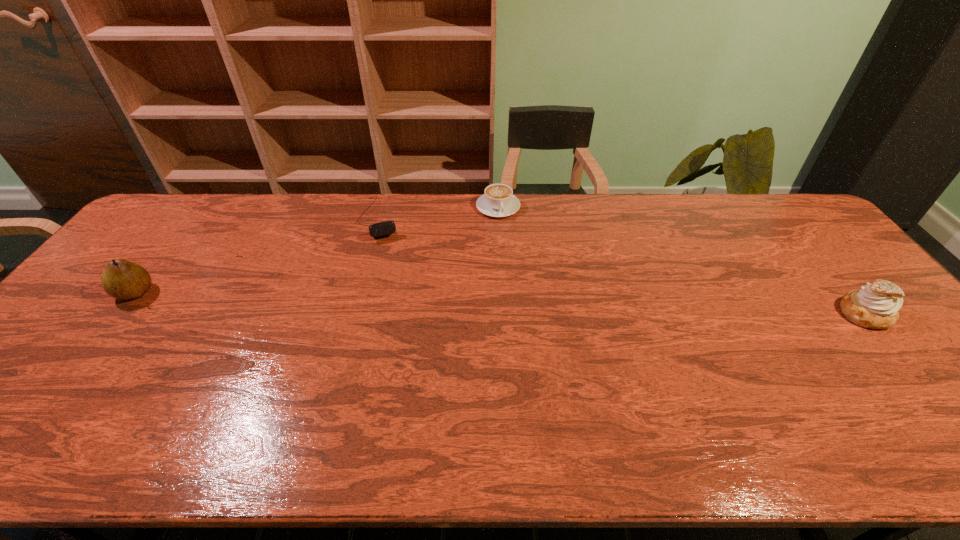
The image size is (960, 540). I want to click on free space located on the side of the cappuccino with the handle, so click(x=523, y=280).

The width and height of the screenshot is (960, 540). What are the coordinates of `vacant space situated 0.240m on the front-facing side of the third object from right to left` in the screenshot? It's located at (398, 293).

This screenshot has width=960, height=540. Find the location of `vacant space situated 0.290m on the front-facing side of the third object from right to left`. vacant space situated 0.290m on the front-facing side of the third object from right to left is located at coordinates (403, 305).

Where is `free space located 0.190m on the front-facing side of the third object from right to left`? The height and width of the screenshot is (540, 960). free space located 0.190m on the front-facing side of the third object from right to left is located at coordinates (395, 281).

This screenshot has width=960, height=540. Find the location of `cappuccino that is at the far edge`. cappuccino that is at the far edge is located at coordinates (498, 200).

Where is `webcam that is at the far edge`? webcam that is at the far edge is located at coordinates (386, 228).

The image size is (960, 540). I want to click on object present at the left edge, so click(121, 279).

Find the location of a particular element. object present at the right edge is located at coordinates (875, 306).

Locate an element on the screen. vacant point at the far edge is located at coordinates (552, 228).

You are a GUI agent. You are given a task and a screenshot of the screen. Output one action in this format:
    pyautogui.click(x=<x>, y=<y>)
    Task: Click on the free point at the near edge
    
    Given the screenshot: What is the action you would take?
    pyautogui.click(x=134, y=396)